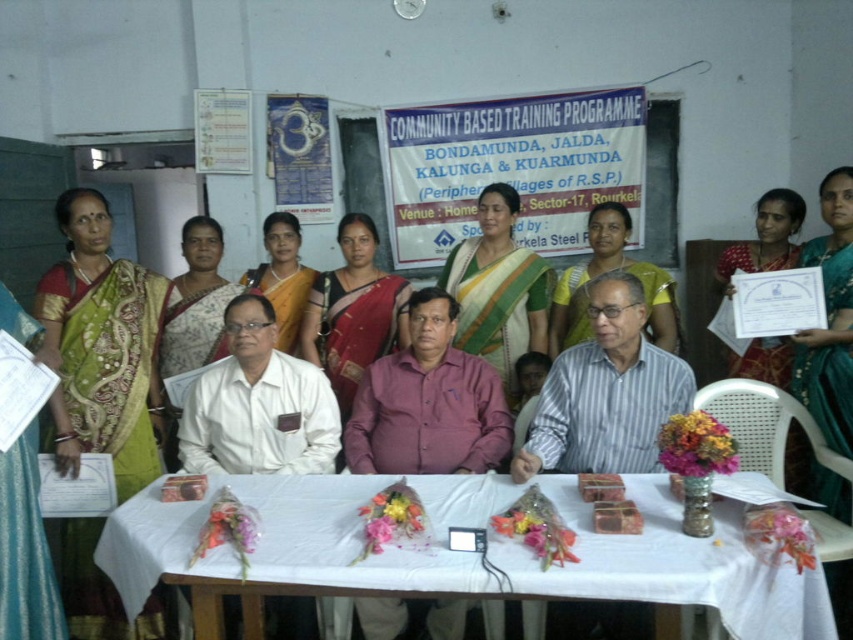
Consider the image. Can you confirm if satin sari at center is positioned to the left of white saree at center?

Incorrect, satin sari at center is not on the left side of white saree at center.

Who is more distant from viewer, (378, 348) or (158, 371)?

Point (378, 348)

You are a GUI agent. You are given a task and a screenshot of the screen. Output one action in this format:
    pyautogui.click(x=<x>, y=<y>)
    Task: Click on the satin sari at center
    This screenshot has height=640, width=853.
    Given the screenshot: What is the action you would take?
    pyautogui.click(x=352, y=310)

Can you confirm if green silk saree at left is shorter than yellow-green sari at center?

In fact, green silk saree at left may be taller than yellow-green sari at center.

Is green silk saree at left further to camera compared to yellow-green sari at center?

No, green silk saree at left is closer to the viewer.

Does point (144, 360) come closer to viewer compared to point (663, 296)?

That is True.

Find the location of a particular element. The height and width of the screenshot is (640, 853). green silk saree at left is located at coordinates pyautogui.click(x=103, y=340).

Can you confirm if satin sari at center is positioned to the right of yellow-green sari at center?

In fact, satin sari at center is to the left of yellow-green sari at center.

Is satin sari at center closer to the viewer compared to yellow-green sari at center?

Yes, it is in front of yellow-green sari at center.

Who is more distant from viewer, (339, 298) or (640, 272)?

Positioned behind is point (640, 272).

Find the location of a particular element. The image size is (853, 640). satin sari at center is located at coordinates (352, 310).